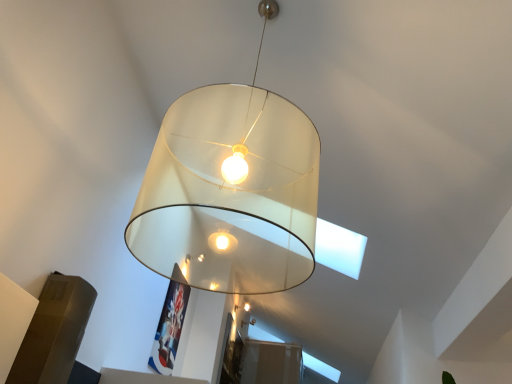
This screenshot has height=384, width=512. What do you see at coordinates (230, 192) in the screenshot?
I see `translucent white lampshade at center` at bounding box center [230, 192].

This screenshot has width=512, height=384. Identify the location of translucent white lampshade at center. (230, 192).

Locate an element on the screen. translucent white lampshade at center is located at coordinates (230, 192).